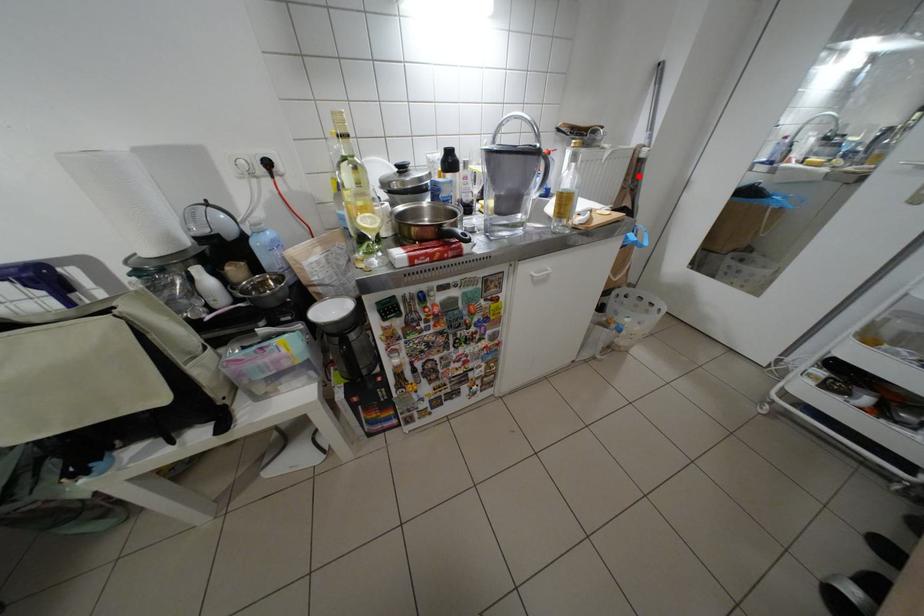
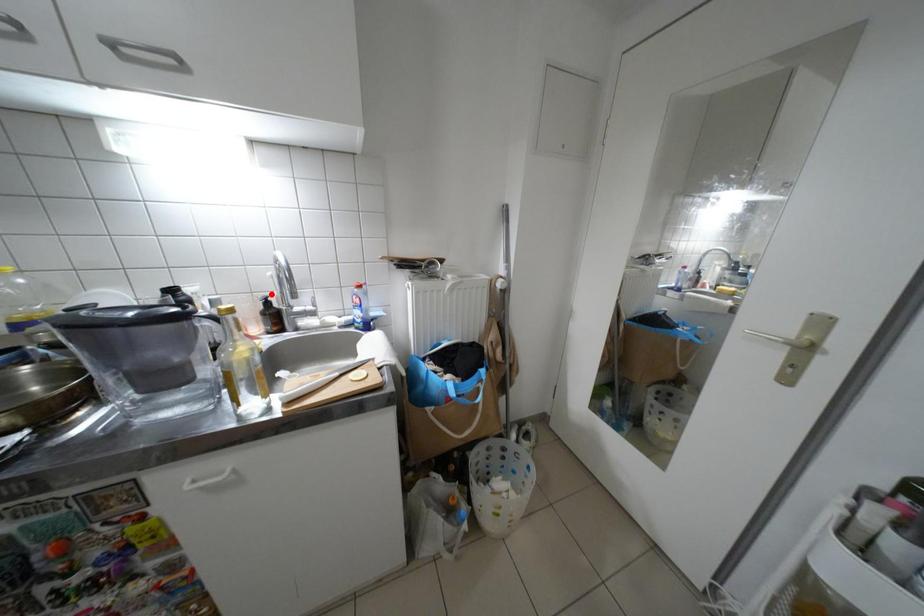
I am providing you with two images of the same scene from different viewpoints. A red point is marked on the first image and another point is marked on the second image. Are the points marked in image1 and image2 representing the same 3D position?

No